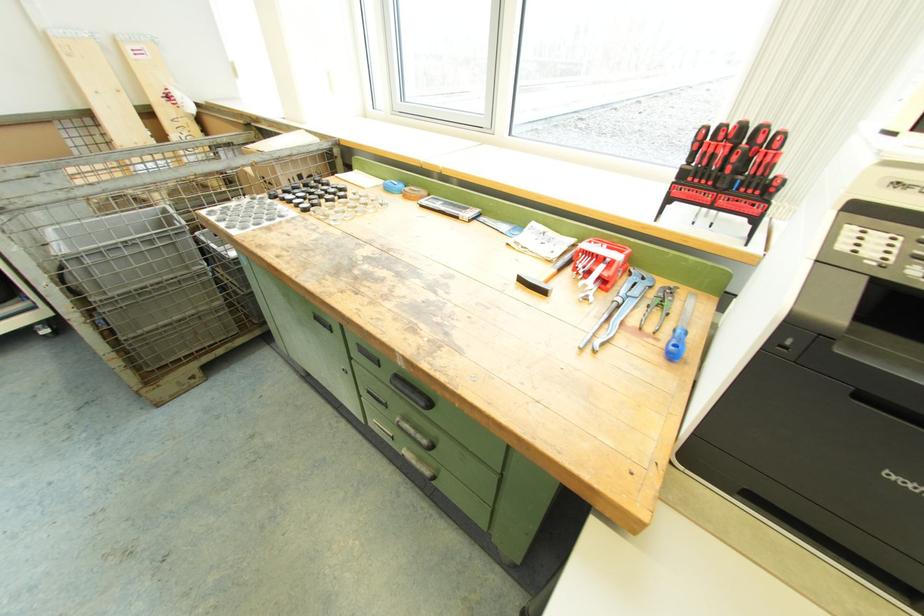
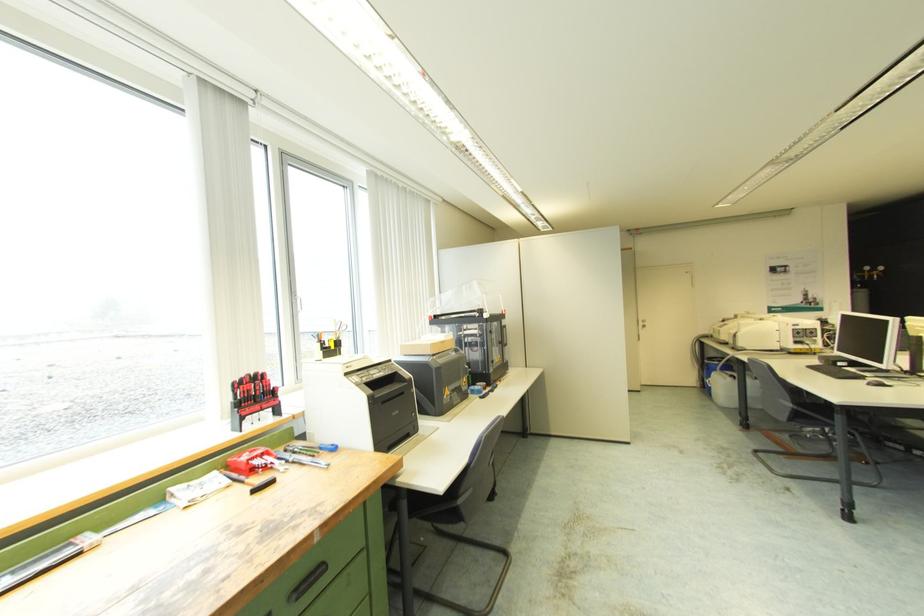
Locate, in the second image, the point that corresponds to (x=588, y=246) in the first image.

(248, 458)